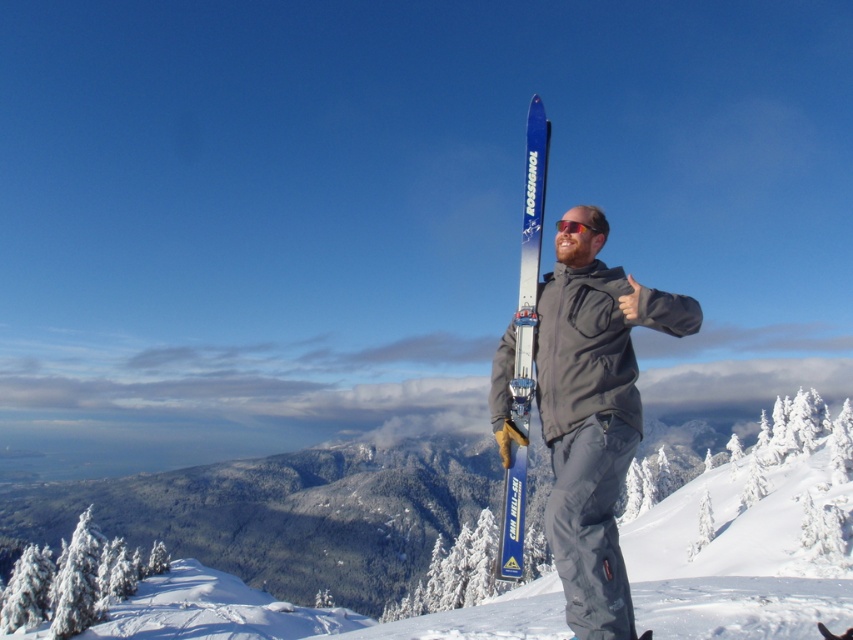
You are a photographer capturing the scene of the person on the snowy mountain peak. You notice the blue metallic ski at center and the shiny orange sunglasses at center. Which object would block more of the background view if placed closer to the camera?

The blue metallic ski at center has a larger size compared to the shiny orange sunglasses at center, so it would block more of the background view when placed closer to the camera.